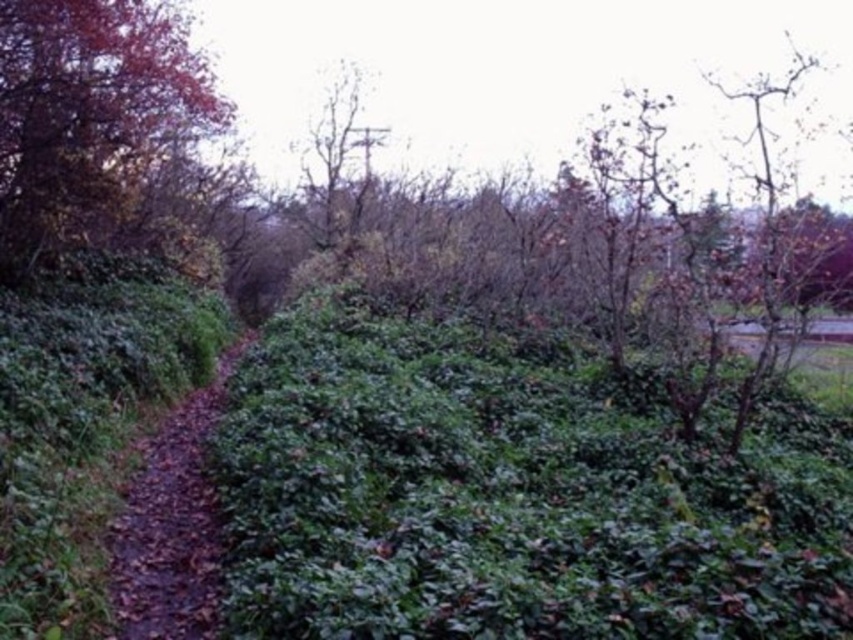
Question: Can you confirm if green leafy hedge at center is bigger than bare wood tree at center?

Choices:
 (A) yes
 (B) no

Answer: (A)

Question: Which point is closer to the camera?

Choices:
 (A) (172, 584)
 (B) (138, 12)
 (C) (376, 125)
 (D) (509, 353)

Answer: (A)

Question: Can you confirm if brown dirt path at center is positioned below bare wood tree at center?

Choices:
 (A) no
 (B) yes

Answer: (B)

Question: Which of these objects is positioned farthest from the green leafy hedge at center?

Choices:
 (A) brown dirt path at center
 (B) shiny red leaves at upper left
 (C) bare wood tree at center

Answer: (C)

Question: Where is brown dirt path at center located in relation to bare wood tree at center in the image?

Choices:
 (A) left
 (B) right

Answer: (A)

Question: Considering the real-world distances, which object is closest to the brown dirt path at center?

Choices:
 (A) bare wood tree at center
 (B) shiny red leaves at upper left
 (C) green leafy hedge at center

Answer: (C)